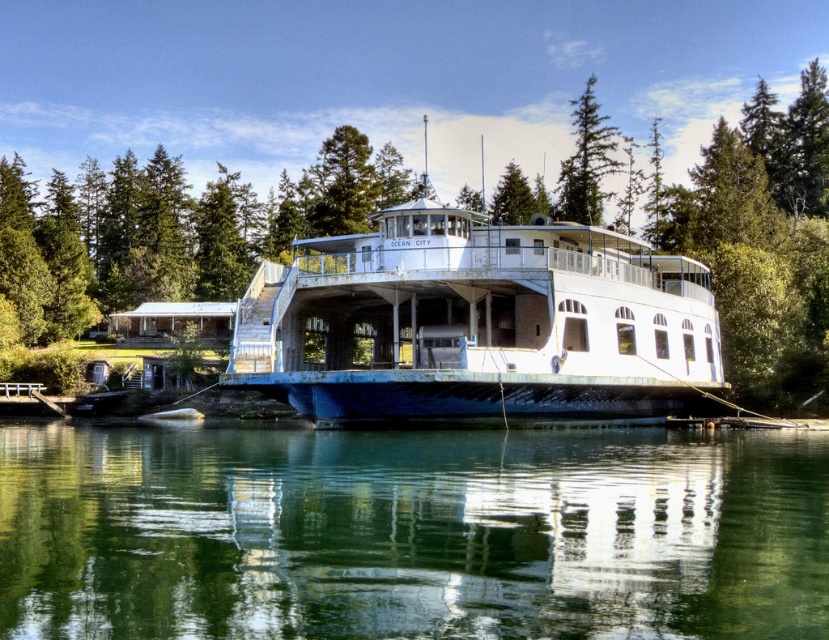
Is clear water at lower center wider than green textured pine tree at upper center?

Yes, clear water at lower center is wider than green textured pine tree at upper center.

Which is in front, point (371, 481) or point (580, 221)?

Point (371, 481) is more forward.

Identify the location of clear water at lower center. The height and width of the screenshot is (640, 829). (411, 532).

Can you confirm if white matte boat at center is bigger than green textured pine tree at upper center?

Yes.

Which of these two, white matte boat at center or green textured pine tree at upper center, stands shorter?

Standing shorter between the two is white matte boat at center.

Is point (411, 314) less distant than point (594, 108)?

Yes, it is.

Find the location of `white matte boat at center`. white matte boat at center is located at coordinates (478, 324).

Between point (211, 525) and point (240, 376), which one is positioned behind?

The point (240, 376) is more distant.

Between clear water at lower center and white matte boat at center, which one has less height?

With less height is clear water at lower center.

The image size is (829, 640). What do you see at coordinates (411, 532) in the screenshot?
I see `clear water at lower center` at bounding box center [411, 532].

Where is `clear water at lower center`? The width and height of the screenshot is (829, 640). clear water at lower center is located at coordinates (411, 532).